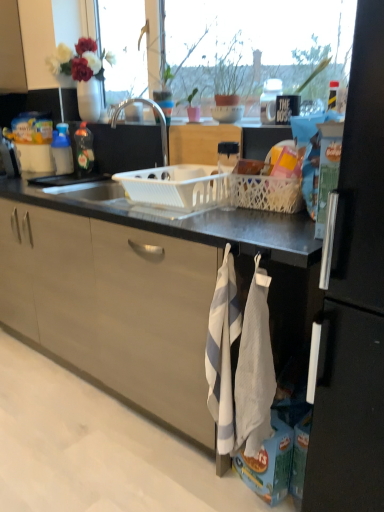
Question: Considering the relative sizes of white plastic basket at center and white textured hand towel at lower center, acting as the second hand towel starting from the right, in the image provided, is white plastic basket at center bigger than white textured hand towel at lower center, acting as the second hand towel starting from the right,?

Choices:
 (A) yes
 (B) no

Answer: (B)

Question: Can you confirm if white plastic basket at center is smaller than white textured hand towel at lower center, acting as the second hand towel starting from the right?

Choices:
 (A) no
 (B) yes

Answer: (B)

Question: Is white plastic basket at center at the left side of white textured hand towel at lower center, which is the first hand towel from left to right?

Choices:
 (A) no
 (B) yes

Answer: (B)

Question: Is white plastic basket at center completely or partially outside of white textured hand towel at lower center, which is the first hand towel from left to right?

Choices:
 (A) yes
 (B) no

Answer: (A)

Question: Is white plastic basket at center facing towards white textured hand towel at lower center, acting as the second hand towel starting from the right?

Choices:
 (A) yes
 (B) no

Answer: (B)

Question: From a real-world perspective, is white plastic basket at center positioned under white textured hand towel at lower center, acting as the second hand towel starting from the right, based on gravity?

Choices:
 (A) no
 (B) yes

Answer: (A)

Question: Does black matte refrigerator at right come behind translucent plastic bottle at left, acting as the first kitchen appliance starting from the right?

Choices:
 (A) no
 (B) yes

Answer: (A)

Question: Does black matte refrigerator at right have a greater width compared to translucent plastic bottle at left, which appears as the 2th kitchen appliance when viewed from the left?

Choices:
 (A) no
 (B) yes

Answer: (B)

Question: From a real-world perspective, is black matte refrigerator at right physically above translucent plastic bottle at left, which appears as the 2th kitchen appliance when viewed from the left?

Choices:
 (A) no
 (B) yes

Answer: (A)

Question: Is there a large distance between black matte refrigerator at right and translucent plastic bottle at left, acting as the first kitchen appliance starting from the right?

Choices:
 (A) no
 (B) yes

Answer: (B)

Question: Can you see black matte refrigerator at right touching translucent plastic bottle at left, acting as the first kitchen appliance starting from the right?

Choices:
 (A) yes
 (B) no

Answer: (B)

Question: Could you tell me if black matte refrigerator at right is facing translucent plastic bottle at left, acting as the first kitchen appliance starting from the right?

Choices:
 (A) no
 (B) yes

Answer: (A)

Question: Does white mesh basket at right, positioned as the 1th basket in right-to-left order, lie in front of white textured hand towel at lower right, which ranks as the 1th hand towel in right-to-left order?

Choices:
 (A) no
 (B) yes

Answer: (A)